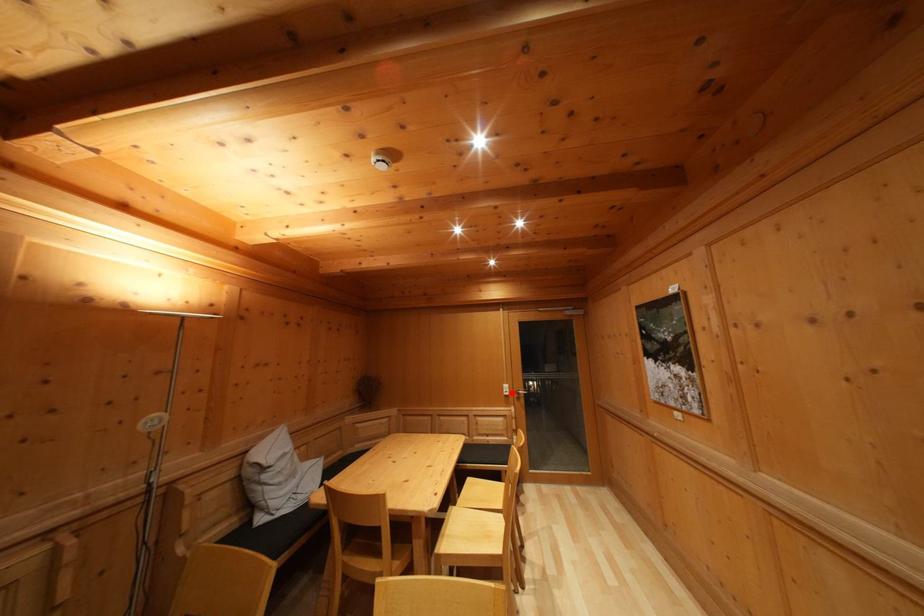
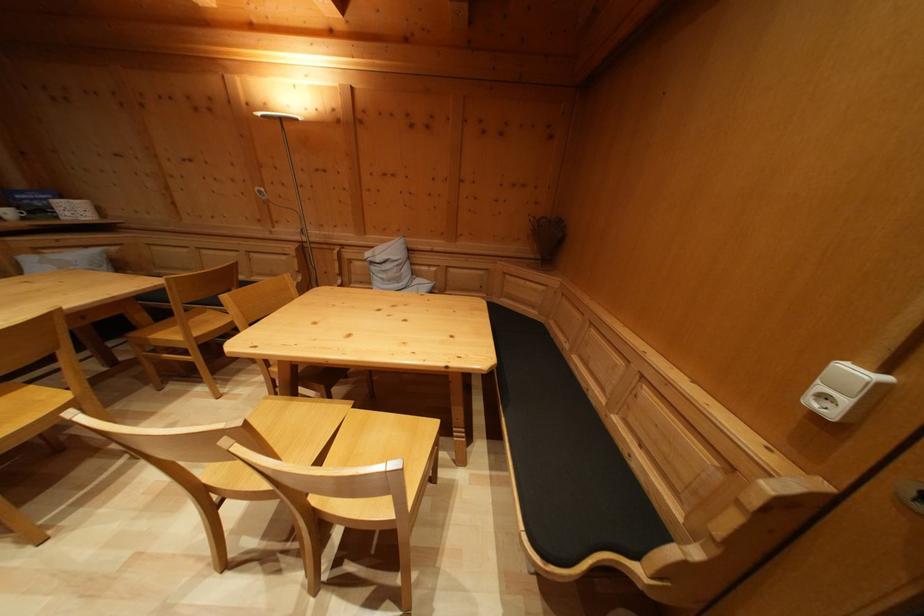
The point at the highlighted location is marked in the first image. Where is the corresponding point in the second image?

(859, 379)